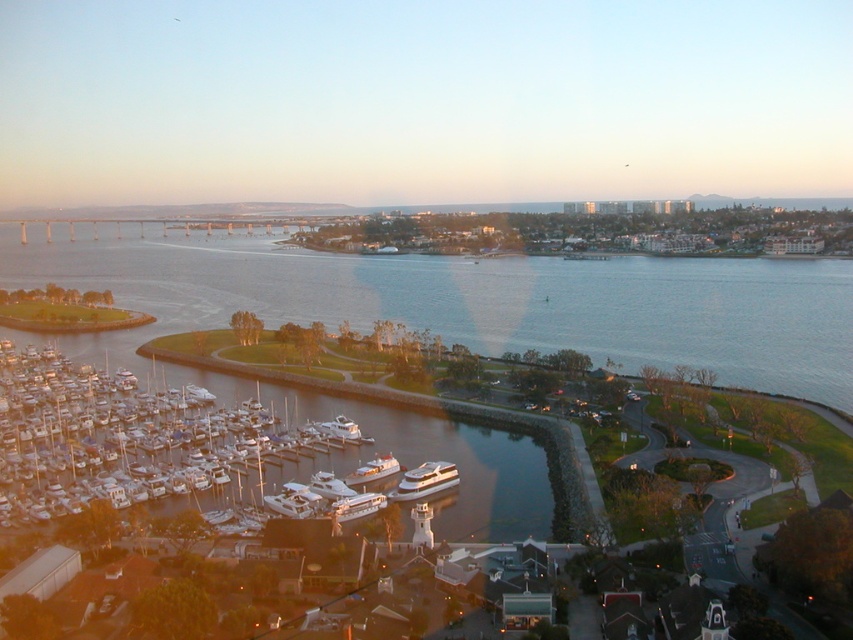
Question: Among these objects, which one is farthest from the camera?

Choices:
 (A) white glossy yacht at center
 (B) white glossy boat at center

Answer: (B)

Question: Can you confirm if shiny white yacht at center is smaller than white glossy boat at center?

Choices:
 (A) no
 (B) yes

Answer: (A)

Question: Which point is farther from the camera taking this photo?

Choices:
 (A) (338, 422)
 (B) (451, 483)

Answer: (A)

Question: Which point is farther from the camera taking this photo?

Choices:
 (A) (340, 426)
 (B) (363, 492)

Answer: (A)

Question: Can you confirm if blue water at center is wider than shiny white yacht at center?

Choices:
 (A) no
 (B) yes

Answer: (B)

Question: Does blue water at center appear on the left side of white glossy boats at lower left?

Choices:
 (A) no
 (B) yes

Answer: (B)